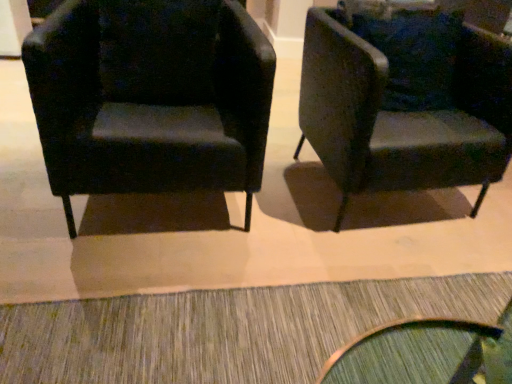
Question: Looking at the image, does textured gray doormat at lower center seem bigger or smaller compared to matte black armchair at left, the 2th chair viewed from the right?

Choices:
 (A) small
 (B) big

Answer: (A)

Question: Is textured gray doormat at lower center in front of or behind matte black armchair at left, acting as the first chair starting from the left, in the image?

Choices:
 (A) behind
 (B) front

Answer: (B)

Question: Which object is the farthest from the textured gray doormat at lower center?

Choices:
 (A) matte black armchair at left, the 2th chair viewed from the right
 (B) velvet dark green armchair at right, which is the second chair from left to right

Answer: (B)

Question: Considering the real-world distances, which object is closest to the velvet dark green armchair at right, which is the second chair from left to right?

Choices:
 (A) matte black armchair at left, acting as the first chair starting from the left
 (B) textured gray doormat at lower center

Answer: (A)